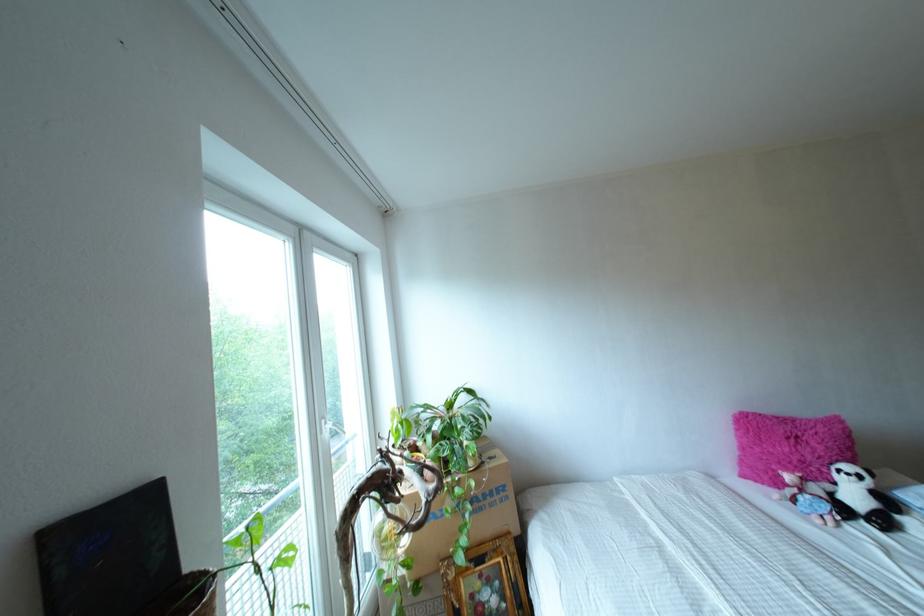
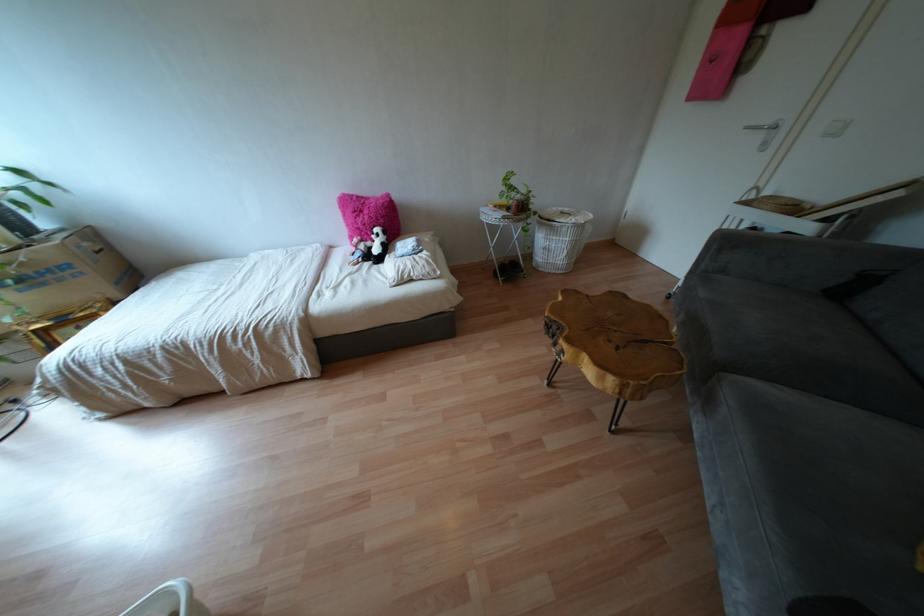
The point at (820,447) is marked in the first image. Where is the corresponding point in the second image?

(365, 217)